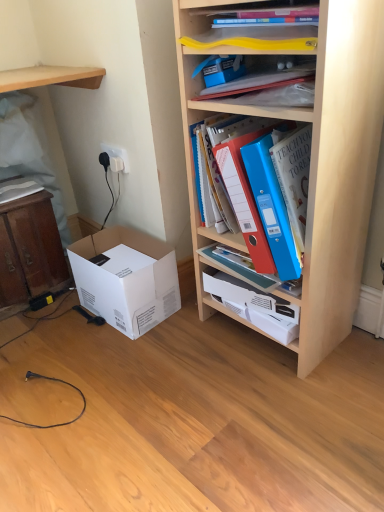
Locate an element on the screen. The height and width of the screenshot is (512, 384). space that is in front of white cardboard box at lower left is located at coordinates (130, 358).